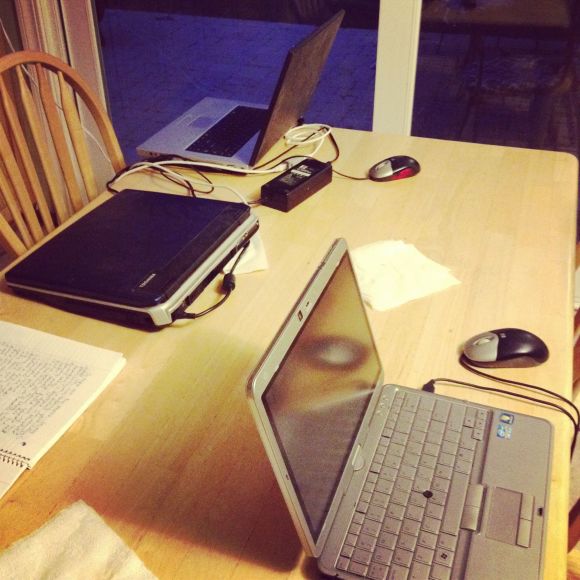
Locate an element on the screen. mouse cable is located at coordinates (514, 380), (345, 174).